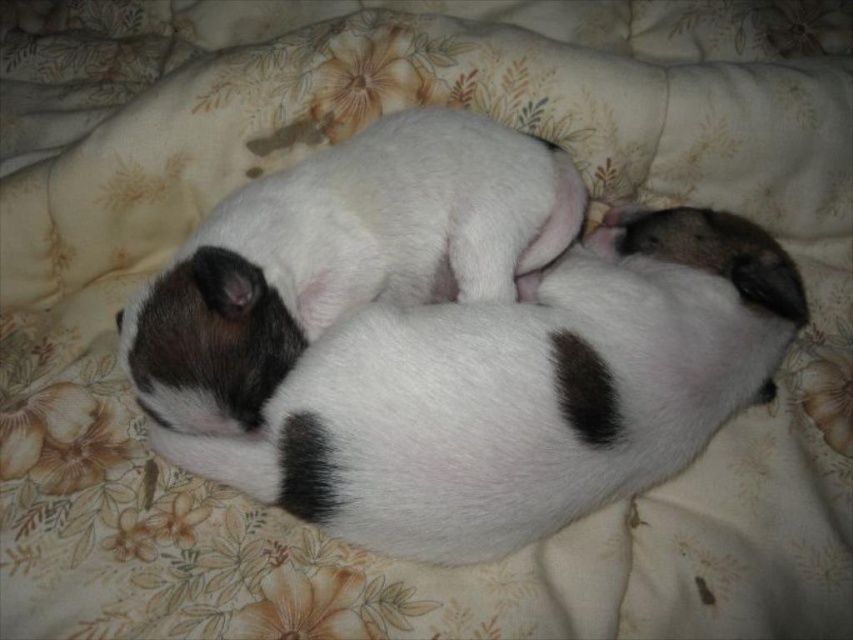
Can you confirm if white soft fur dog at center is wider than white fur dog at center?

Yes.

I want to click on white soft fur dog at center, so click(521, 394).

Is point (491, 332) closer to viewer compared to point (280, 300)?

That is True.

Identify the location of white soft fur dog at center. (521, 394).